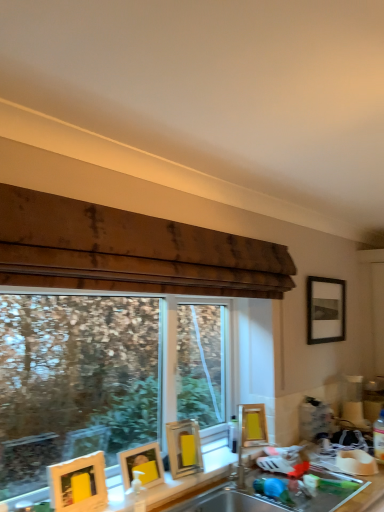
Question: Does matte gold picture frame at lower left, placed as the second picture frame when sorted from left to right, have a smaller size compared to matte silver sink at center, marked as the 1th sink in a top-to-bottom arrangement?

Choices:
 (A) no
 (B) yes

Answer: (B)

Question: From a real-world perspective, is matte gold picture frame at lower left, placed as the second picture frame when sorted from left to right, located beneath matte silver sink at center, which is the second sink in bottom-to-top order?

Choices:
 (A) no
 (B) yes

Answer: (B)

Question: Can we say matte gold picture frame at lower left, placed as the second picture frame when sorted from left to right, lies outside matte silver sink at center, which is the second sink in bottom-to-top order?

Choices:
 (A) no
 (B) yes

Answer: (B)

Question: Is matte silver sink at center, which is the second sink in bottom-to-top order, located within matte gold picture frame at lower left, placed as the second picture frame when sorted from left to right?

Choices:
 (A) yes
 (B) no

Answer: (B)

Question: Is matte gold picture frame at lower left, marked as the fourth picture frame in a back-to-front arrangement, thinner than matte silver sink at center, which is the second sink in bottom-to-top order?

Choices:
 (A) yes
 (B) no

Answer: (A)

Question: Considering the relative positions of transparent glass window at center and stainless steel sink at lower center, placed as the 1th sink when sorted from bottom to top, in the image provided, is transparent glass window at center to the left of stainless steel sink at lower center, placed as the 1th sink when sorted from bottom to top, from the viewer's perspective?

Choices:
 (A) no
 (B) yes

Answer: (B)

Question: From a real-world perspective, is transparent glass window at center physically below stainless steel sink at lower center, placed as the 1th sink when sorted from bottom to top?

Choices:
 (A) no
 (B) yes

Answer: (A)

Question: Is transparent glass window at center closer to the viewer compared to stainless steel sink at lower center, placed as the second sink when sorted from top to bottom?

Choices:
 (A) yes
 (B) no

Answer: (B)

Question: Can you confirm if transparent glass window at center is smaller than stainless steel sink at lower center, placed as the second sink when sorted from top to bottom?

Choices:
 (A) no
 (B) yes

Answer: (A)

Question: Is transparent glass window at center thinner than stainless steel sink at lower center, placed as the second sink when sorted from top to bottom?

Choices:
 (A) no
 (B) yes

Answer: (B)

Question: Is transparent glass window at center positioned far away from stainless steel sink at lower center, placed as the 1th sink when sorted from bottom to top?

Choices:
 (A) yes
 (B) no

Answer: (A)

Question: From a real-world perspective, is yellow matte picture frame at lower center, which is counted as the 3th picture frame, starting from the front, physically below stainless steel sink at lower center, placed as the 1th sink when sorted from bottom to top?

Choices:
 (A) yes
 (B) no

Answer: (B)